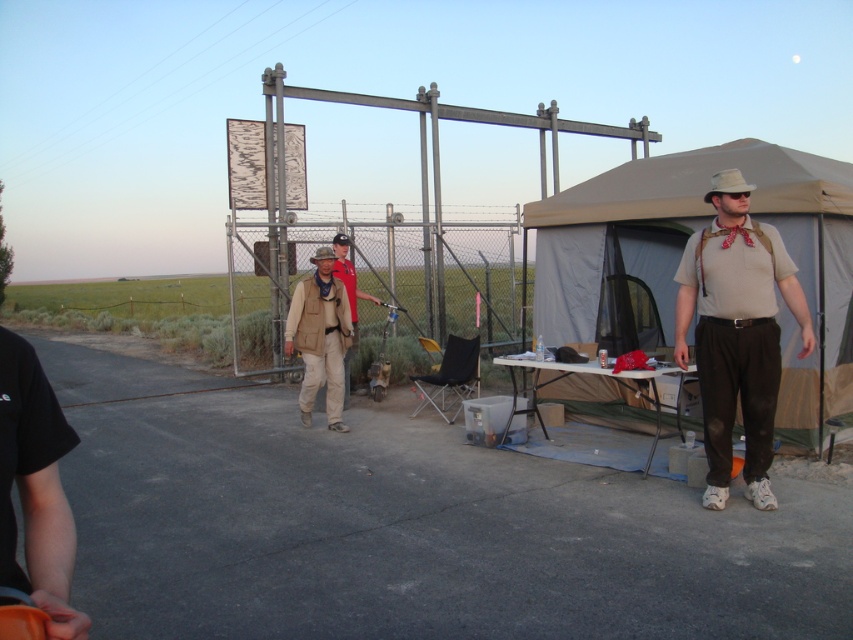
You are planning to pack your camping gear. You have a tan canvas tent at right and a tan fabric vest at center. Which item should you pack first if you want to place the smaller item into the larger one?

The tan canvas tent at right has a smaller size compared to tan fabric vest at center, so you should pack the tan canvas tent at right first into the tan fabric vest at center.

Consider the image. You are standing at the point labeled as point (347,244) and want to walk towards the beige pop up tent on the right side. Which direction should you move relative to the other point labeled point (817,209)?

You should move towards point (817,209) because it is closer to the viewer and in the direction of the beige pop up tent on the right side.

You are a hiker who just arrived at the campsite. You see the tan canvas tent at right and the tan fabric vest at center. Which item is closer to you?

The tan canvas tent at right is closer to you because the tan fabric vest at center is behind it.